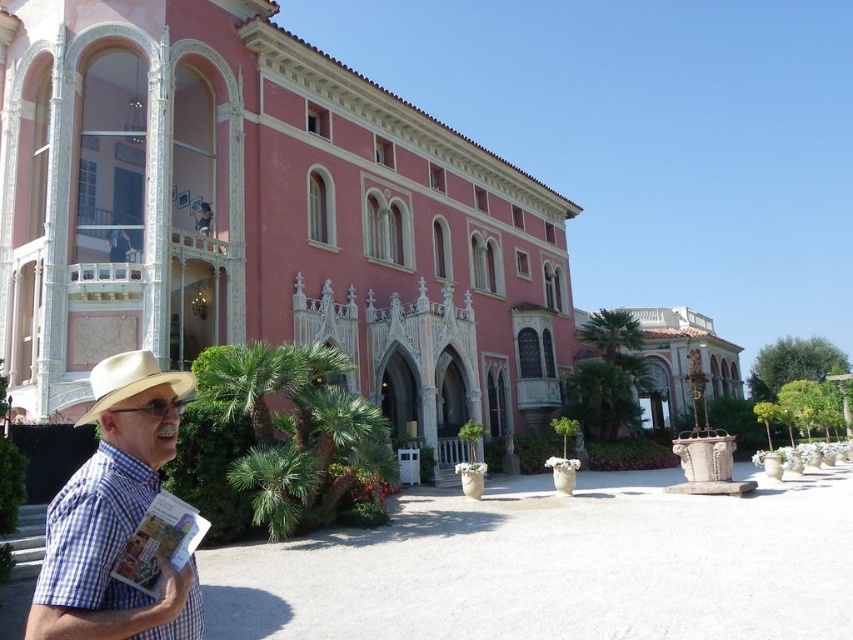
Question: Is pink stucco palace at center positioned in front of white felt cowboy hat at lower left?

Choices:
 (A) no
 (B) yes

Answer: (A)

Question: Which of these objects is positioned farthest from the white felt cowboy hat at lower left?

Choices:
 (A) matte pink building at center
 (B) blue checkered shirt at lower left
 (C) pink stucco palace at center

Answer: (A)

Question: Is pink stucco palace at center thinner than blue checkered shirt at lower left?

Choices:
 (A) yes
 (B) no

Answer: (B)

Question: Can you confirm if pink stucco palace at center is wider than blue checkered shirt at lower left?

Choices:
 (A) no
 (B) yes

Answer: (B)

Question: Which is farther from the white felt cowboy hat at lower left?

Choices:
 (A) blue checkered shirt at lower left
 (B) pink stucco palace at center
 (C) matte pink building at center

Answer: (C)

Question: Among these objects, which one is farthest from the camera?

Choices:
 (A) pink stucco palace at center
 (B) matte pink building at center
 (C) white felt cowboy hat at lower left

Answer: (B)